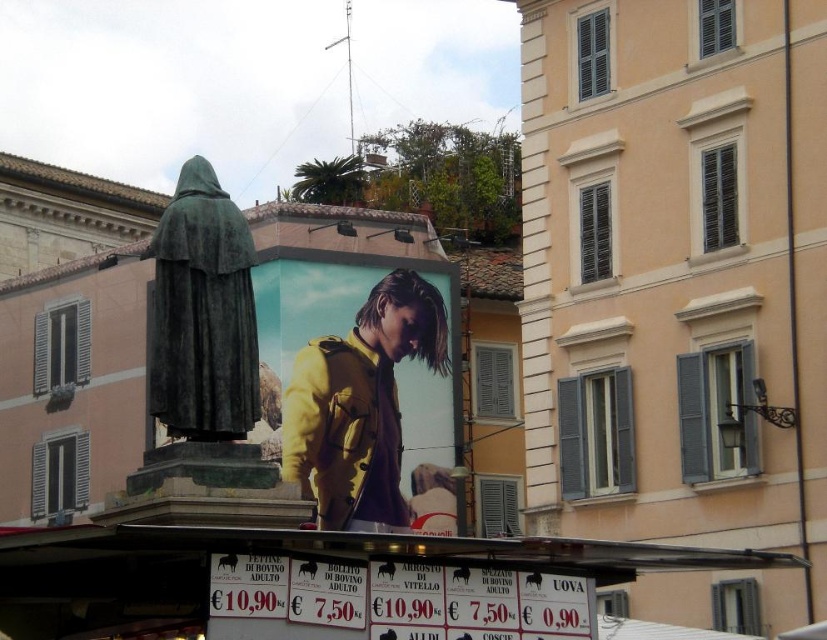
You are a tourist holding a map and looking at the white paper signboard at lower center and the green bronze statue at center. Which object is wider? Please check the width of both objects to determine.

The white paper signboard at lower center has a lesser width compared to the green bronze statue at center, so the green bronze statue at center is wider.

You are a tourist holding a map and looking at the yellow matte jacket at center and the white paper signboard at lower center. Which object is closer to you?

The yellow matte jacket at center is closer to you because it is further to the viewer than the white paper signboard at lower center.